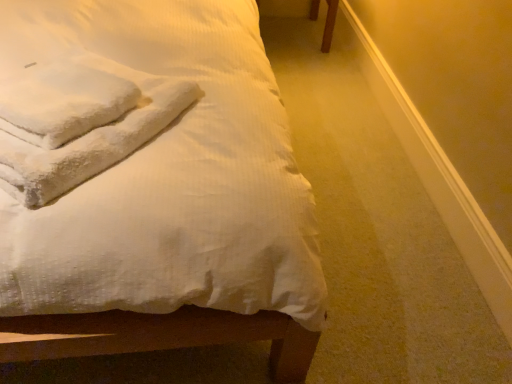
Find the location of a particular element. The height and width of the screenshot is (384, 512). white textured bed at upper left is located at coordinates (153, 170).

The height and width of the screenshot is (384, 512). Describe the element at coordinates (153, 170) in the screenshot. I see `white textured bed at upper left` at that location.

The width and height of the screenshot is (512, 384). What do you see at coordinates (79, 122) in the screenshot?
I see `white fluffy towels at upper left` at bounding box center [79, 122].

At what (x,y) coordinates should I click in order to perform the action: click on white fluffy towels at upper left. Please return your answer as a coordinate pair (x, y). Looking at the image, I should click on (79, 122).

Find the location of a particular element. This screenshot has width=512, height=384. white textured bed at upper left is located at coordinates (153, 170).

Considering the relative positions of white textured bed at upper left and white fluffy towels at upper left in the image provided, is white textured bed at upper left to the left or to the right of white fluffy towels at upper left?

white textured bed at upper left is positioned on white fluffy towels at upper left's left side.

Which is behind, white textured bed at upper left or white fluffy towels at upper left?

white fluffy towels at upper left is behind.

Does point (61, 128) come in front of point (27, 99)?

Yes.

From the image's perspective, relative to white fluffy towels at upper left, is white textured bed at upper left above or below?

Based on their image positions, white textured bed at upper left is located above white fluffy towels at upper left.

From a real-world perspective, which object stands above the other?

white fluffy towels at upper left is physically above.

Is white textured bed at upper left wider than white fluffy towels at upper left?

Yes.

Considering the sizes of white textured bed at upper left and white fluffy towels at upper left in the image, is white textured bed at upper left taller or shorter than white fluffy towels at upper left?

Considering their sizes, white textured bed at upper left has more height than white fluffy towels at upper left.

Considering the relative sizes of white textured bed at upper left and white fluffy towels at upper left in the image provided, is white textured bed at upper left bigger than white fluffy towels at upper left?

Yes.

Is white textured bed at upper left positioned beyond the bounds of white fluffy towels at upper left?

Absolutely, white textured bed at upper left is external to white fluffy towels at upper left.

Are white textured bed at upper left and white fluffy towels at upper left far apart?

No, white textured bed at upper left is not far away from white fluffy towels at upper left.

Is white textured bed at upper left oriented towards white fluffy towels at upper left?

Yes, white textured bed at upper left is aimed at white fluffy towels at upper left.

What's the angular difference between white textured bed at upper left and white fluffy towels at upper left's facing directions?

The angular difference between white textured bed at upper left and white fluffy towels at upper left is 38.9 degrees.

How far apart are white textured bed at upper left and white fluffy towels at upper left?

A distance of 13.21 centimeters exists between white textured bed at upper left and white fluffy towels at upper left.

Image resolution: width=512 pixels, height=384 pixels. Find the location of `cloth behind the white textured bed at upper left`. cloth behind the white textured bed at upper left is located at coordinates (79, 122).

In the image, is white fluffy towels at upper left on the left side or the right side of white textured bed at upper left?

white fluffy towels at upper left is to the right of white textured bed at upper left.

Does white fluffy towels at upper left come behind white textured bed at upper left?

Yes, it is.

Is point (66, 116) farther from camera compared to point (159, 198)?

Yes, point (66, 116) is farther from viewer.

From the image's perspective, is white fluffy towels at upper left on top of white textured bed at upper left?

Incorrect, from the image's perspective, white fluffy towels at upper left is lower than white textured bed at upper left.

From a real-world perspective, does white fluffy towels at upper left stand above white textured bed at upper left?

Yes, from a real-world perspective, white fluffy towels at upper left is above white textured bed at upper left.

In terms of width, does white fluffy towels at upper left look wider or thinner when compared to white textured bed at upper left?

white fluffy towels at upper left is thinner than white textured bed at upper left.

Does white fluffy towels at upper left have a lesser height compared to white textured bed at upper left?

Yes.

Based on their sizes in the image, would you say white fluffy towels at upper left is bigger or smaller than white textured bed at upper left?

In the image, white fluffy towels at upper left appears to be smaller than white textured bed at upper left.

Is white fluffy towels at upper left located outside white textured bed at upper left?

No, white fluffy towels at upper left is inside or overlapping with white textured bed at upper left.

Is white fluffy towels at upper left in contact with white textured bed at upper left?

No, white fluffy towels at upper left is not in contact with white textured bed at upper left.

Is white fluffy towels at upper left facing towards white textured bed at upper left?

Yes, white fluffy towels at upper left faces towards white textured bed at upper left.

What's the angular difference between white fluffy towels at upper left and white textured bed at upper left's facing directions?

They differ by 38.9 degrees in their facing directions.

Where is `cloth behind the white textured bed at upper left`? The image size is (512, 384). cloth behind the white textured bed at upper left is located at coordinates (79, 122).

Image resolution: width=512 pixels, height=384 pixels. In order to click on cloth behind the white textured bed at upper left in this screenshot , I will do `click(79, 122)`.

I want to click on cloth located above the white textured bed at upper left (from a real-world perspective), so click(79, 122).